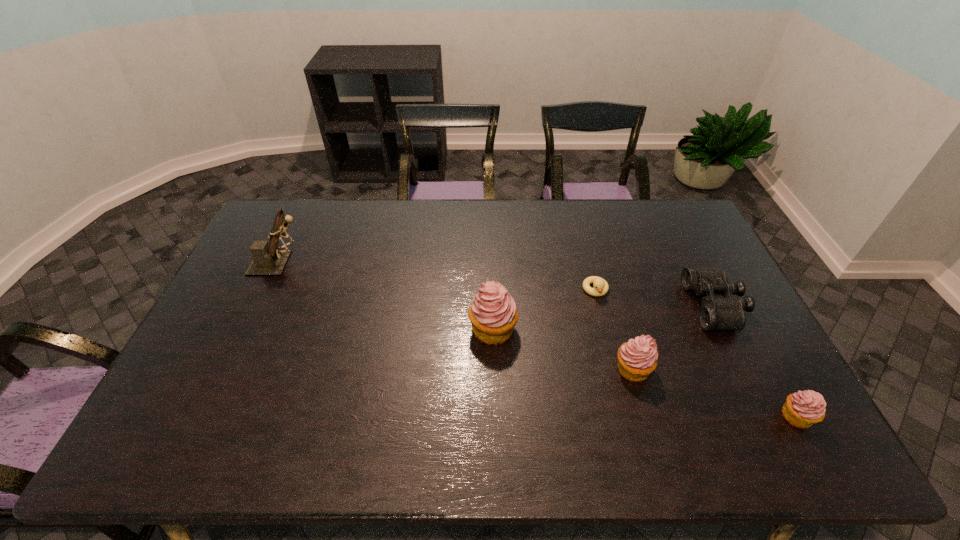
The height and width of the screenshot is (540, 960). Identify the location of free space between the second cupcake from right to left and the tallest cupcake. 563,349.

Image resolution: width=960 pixels, height=540 pixels. What are the coordinates of `free space between the binoculars and the fifth farthest object` in the screenshot? It's located at (674, 337).

I want to click on vacant space that's between the second nearest object and the binoculars, so click(x=674, y=337).

Image resolution: width=960 pixels, height=540 pixels. I want to click on unoccupied area between the duckling and the tallest object, so click(x=438, y=276).

You are a GUI agent. You are given a task and a screenshot of the screen. Output one action in this format:
    pyautogui.click(x=<x>, y=<y>)
    Task: Click on the free space between the shortest cupcake and the fifth farthest object
    The width and height of the screenshot is (960, 540).
    Given the screenshot: What is the action you would take?
    pyautogui.click(x=715, y=392)

What are the coordinates of `object that stands as the fifth closest to the nearest object` in the screenshot? It's located at (269, 259).

Find the location of a particular element. The image size is (960, 540). the third closest object to the shortest object is located at coordinates (716, 313).

Image resolution: width=960 pixels, height=540 pixels. I want to click on cupcake identified as the third closest to the binoculars, so click(x=493, y=314).

Locate an element on the screen. the closest cupcake relative to the figurine is located at coordinates click(x=493, y=314).

Locate an element on the screen. The image size is (960, 540). vacant space that satisfies the following two spatial constraints: 1. at the beak of the rightmost cupcake; 2. on the left side of the shortest object is located at coordinates coord(627,416).